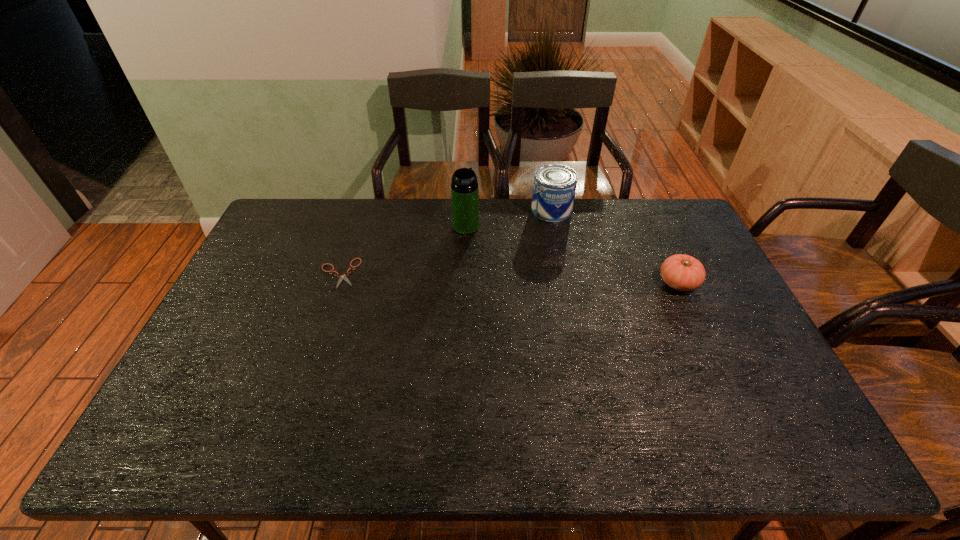
You are a GUI agent. You are given a task and a screenshot of the screen. Output one action in this format:
    pyautogui.click(x=<x>, y=<y>)
    Task: Click on the vacant space located from the spout of the thermos bottle
    This screenshot has height=540, width=960.
    Given the screenshot: What is the action you would take?
    pyautogui.click(x=566, y=292)

The height and width of the screenshot is (540, 960). In order to click on free location located from the spout of the thermos bottle in this screenshot , I will do `click(517, 260)`.

This screenshot has width=960, height=540. Find the location of `vacant space located from the spout of the thermos bottle`. vacant space located from the spout of the thermos bottle is located at coordinates (548, 280).

I want to click on free space located on the front label of the third object from left to right, so click(x=533, y=301).

Where is `free space located 0.300m on the front label of the third object from left to right`? The image size is (960, 540). free space located 0.300m on the front label of the third object from left to right is located at coordinates (538, 279).

Identify the location of free space located on the front label of the third object from left to right. (540, 266).

The width and height of the screenshot is (960, 540). I want to click on thermos bottle at the far edge, so click(x=464, y=187).

This screenshot has width=960, height=540. Identify the location of can present at the far edge. (554, 187).

You are a GUI agent. You are given a task and a screenshot of the screen. Output one action in this format:
    pyautogui.click(x=<x>, y=<y>)
    Task: Click on the object positioned at the right edge
    
    Given the screenshot: What is the action you would take?
    pyautogui.click(x=681, y=272)

Where is `free space at the far edge of the desktop`? The width and height of the screenshot is (960, 540). free space at the far edge of the desktop is located at coordinates (432, 200).